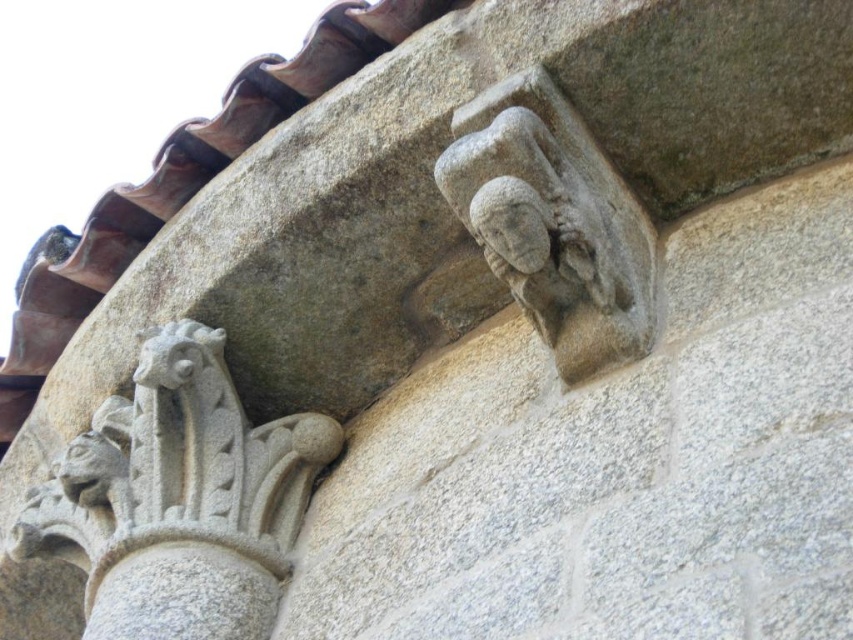
Question: Among these points, which one is nearest to the camera?

Choices:
 (A) (99, 432)
 (B) (640, 260)

Answer: (B)

Question: Is gray stone sculpture at lower left below gray stone head at upper right?

Choices:
 (A) yes
 (B) no

Answer: (A)

Question: Can you confirm if gray stone sculpture at lower left is thinner than gray stone head at upper right?

Choices:
 (A) yes
 (B) no

Answer: (B)

Question: Is gray stone sculpture at lower left behind gray stone head at upper right?

Choices:
 (A) no
 (B) yes

Answer: (A)

Question: Which point is closer to the camera?

Choices:
 (A) gray stone head at upper right
 (B) gray stone sculpture at lower left

Answer: (B)